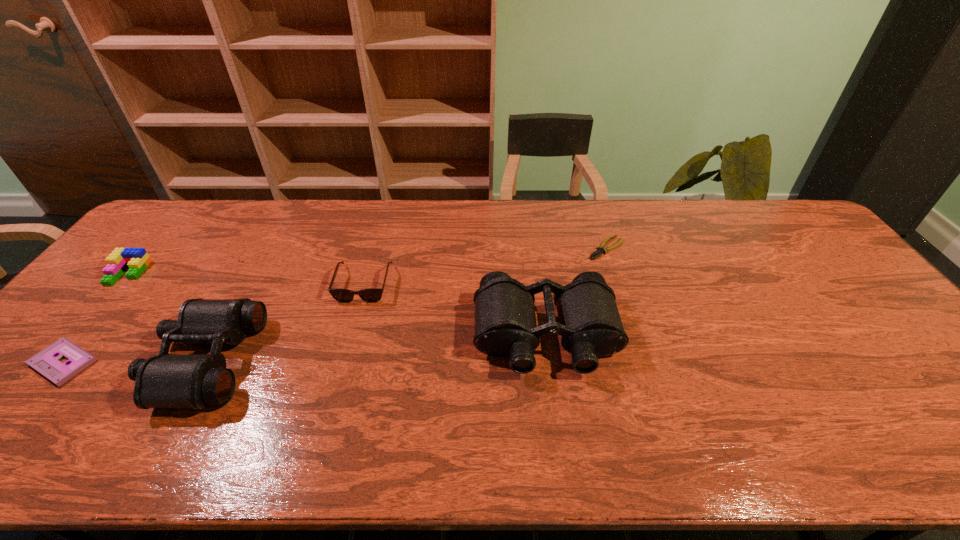
I want to click on vacant place for an extra binoculars on the right, so click(854, 313).